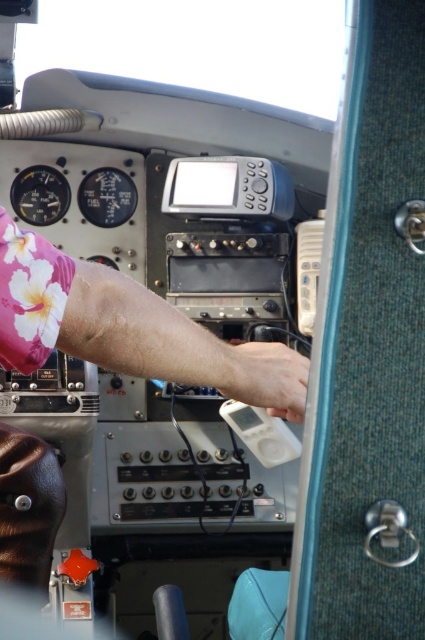
Is pink floral fabric at center shorter than white matte hand at center?

No, pink floral fabric at center is not shorter than white matte hand at center.

Who is more forward, (132, 324) or (294, 362)?

Point (132, 324) is in front.

Locate an element on the screen. This screenshot has width=425, height=640. pink floral fabric at center is located at coordinates [x=127, y=328].